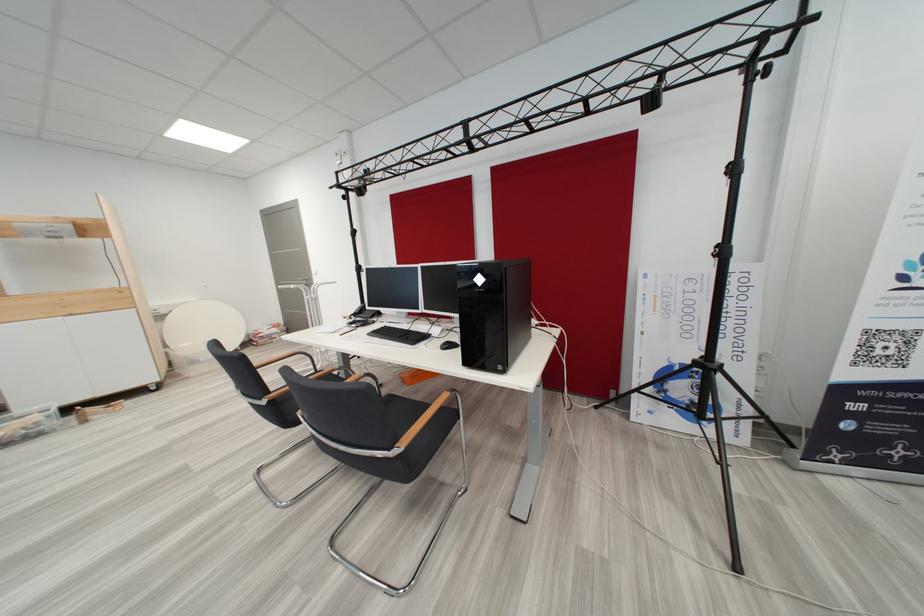
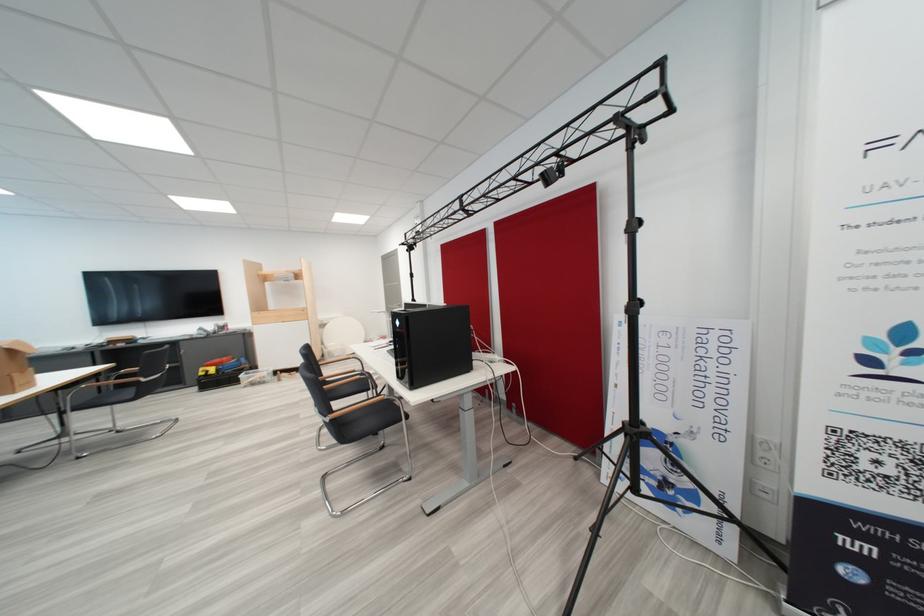
Find the pixel in the second image that matches [490,282] in the first image.

(407, 325)